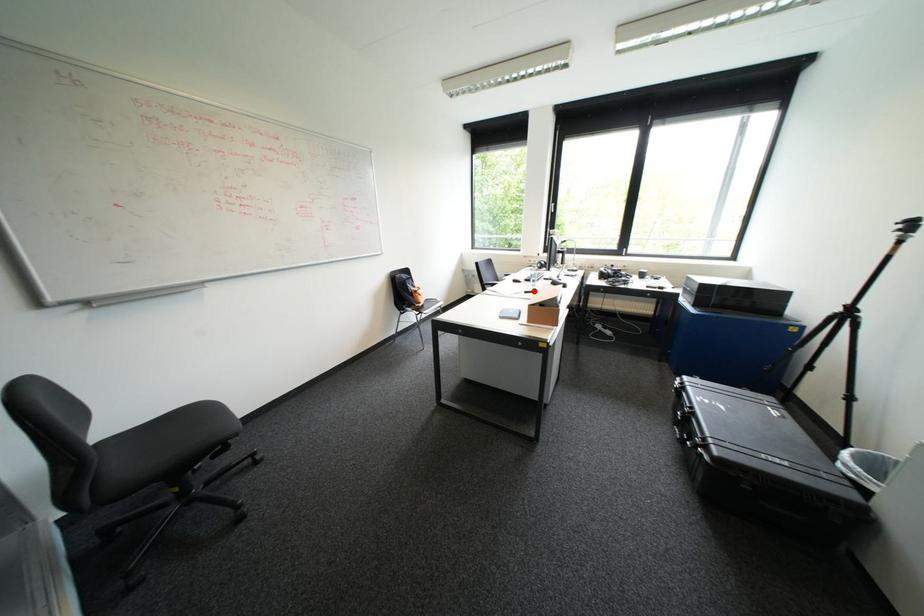
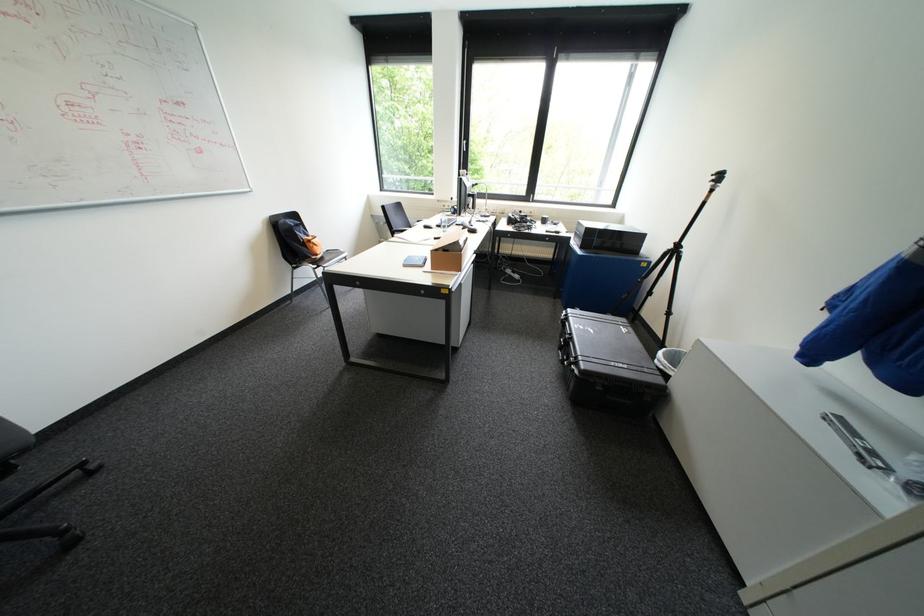
Question: I am providing you with two images of the same scene from different viewpoints. Given a red point in image1, look at the same physical point in image2. Is it:

Choices:
 (A) Closer to the viewpoint
 (B) Farther from the viewpoint

Answer: (B)